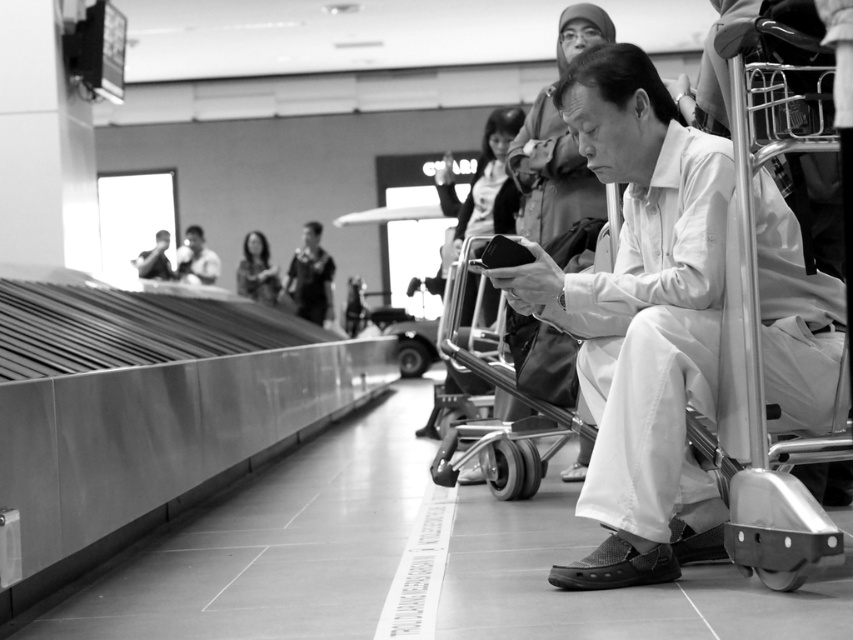
Question: Which of the following is the farthest from the observer?

Choices:
 (A) dark gray jacket at center
 (B) smooth skin face at upper left

Answer: (A)

Question: In this image, where is dark gray jacket at center located relative to smooth black bag at center?

Choices:
 (A) left
 (B) right

Answer: (B)

Question: Which point appears closest to the camera in this image?

Choices:
 (A) (296, 284)
 (B) (194, 259)

Answer: (B)

Question: Is dark gray jacket at center positioned at the back of smooth fabric jacket at center?

Choices:
 (A) yes
 (B) no

Answer: (A)

Question: Which object is positioned closest to the smooth black bag at center?

Choices:
 (A) smooth fabric jacket at center
 (B) dark gray jacket at center

Answer: (A)

Question: Can you confirm if smooth skin face at upper left is positioned below smooth black bag at center?

Choices:
 (A) no
 (B) yes

Answer: (A)